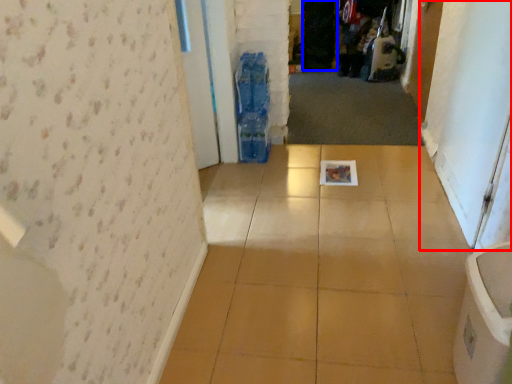
Question: Among these objects, which one is nearest to the camera, screen door (highlighted by a red box) or screen door (highlighted by a blue box)?

Choices:
 (A) screen door
 (B) screen door

Answer: (A)